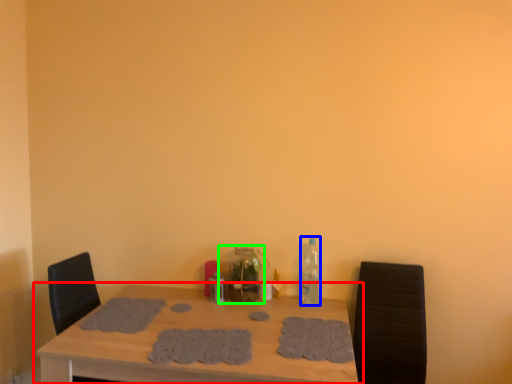
Question: Based on their relative distances, which object is farther from table (highlighted by a red box)? Choose from bottle (highlighted by a blue box) and bottle (highlighted by a green box).

Choices:
 (A) bottle
 (B) bottle

Answer: (A)